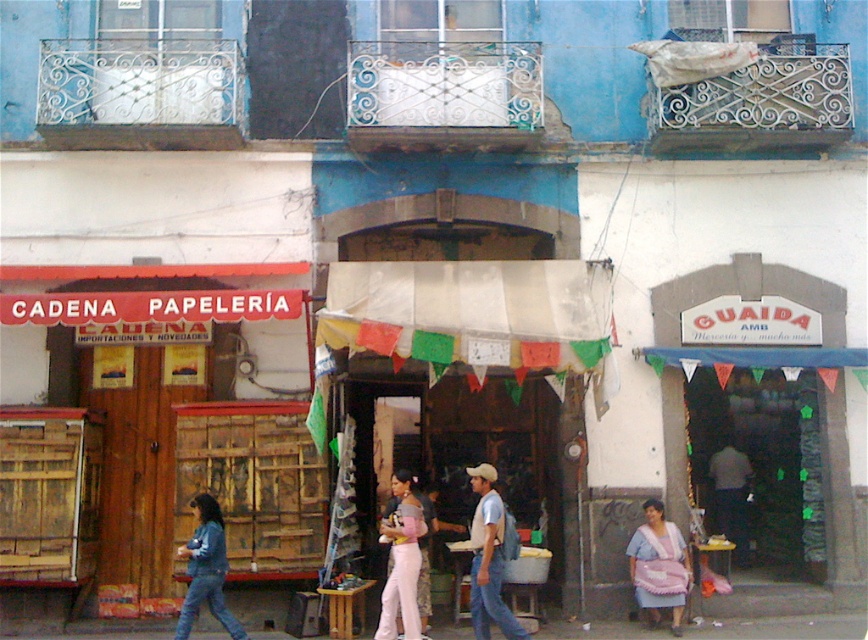
From the picture: Between light blue denim jeans at center and pink fabric at lower right, which one has less height?

Standing shorter between the two is pink fabric at lower right.

Which is in front, point (471, 586) or point (663, 605)?

Point (471, 586) is more forward.

You are a GUI agent. You are given a task and a screenshot of the screen. Output one action in this format:
    pyautogui.click(x=<x>, y=<y>)
    Task: Click on the light blue denim jeans at center
    This screenshot has height=640, width=868.
    Given the screenshot: What is the action you would take?
    pyautogui.click(x=488, y=557)

Based on the photo, is light pink fabric at center bigger than denim jacket at lower left?

Incorrect, light pink fabric at center is not larger than denim jacket at lower left.

Consider the image. Which of these two, light pink fabric at center or denim jacket at lower left, stands taller?

light pink fabric at center

Find the location of a particular element. This screenshot has height=640, width=868. light pink fabric at center is located at coordinates (400, 561).

At what (x,y) coordinates should I click in order to perform the action: click on light pink fabric at center. Please return your answer as a coordinate pair (x, y). Looking at the image, I should click on (400, 561).

Which is in front, point (654, 499) or point (201, 572)?

Positioned in front is point (201, 572).

This screenshot has width=868, height=640. I want to click on pink fabric at lower right, so click(659, 566).